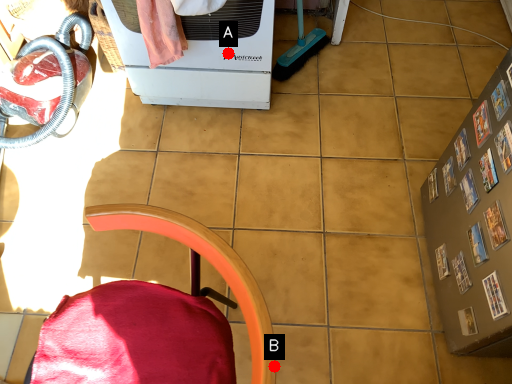
Question: Two points are circled on the image, labeled by A and B beside each circle. Which point is closer to the camera taking this photo?

Choices:
 (A) A is closer
 (B) B is closer

Answer: (B)